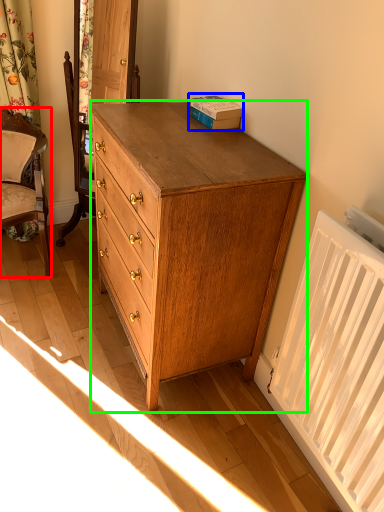
Question: Based on their relative distances, which object is farther from chair (highlighted by a red box)? Choose from book (highlighted by a blue box) and chest of drawers (highlighted by a green box).

Choices:
 (A) book
 (B) chest of drawers

Answer: (A)